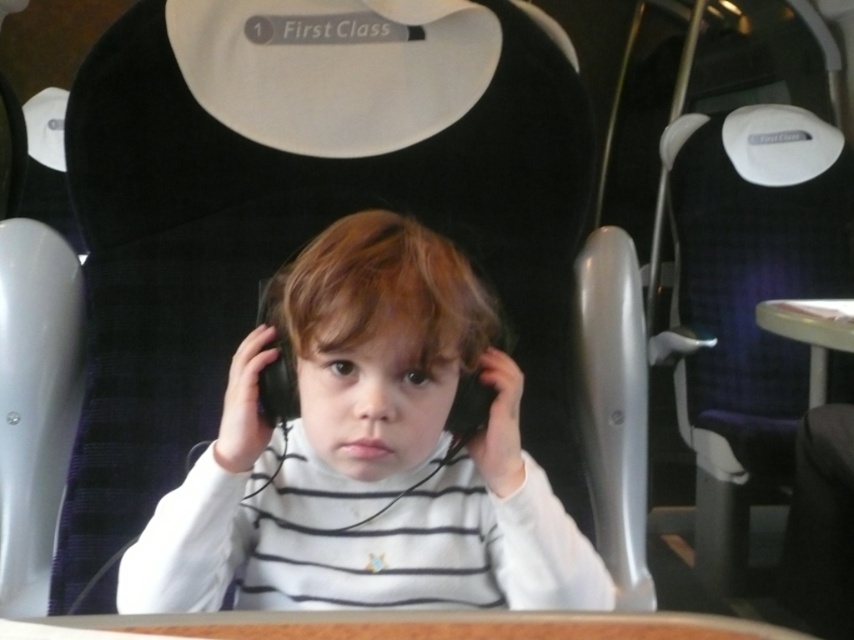
You are a passenger in the first class train compartment and need to place your belongings on the brown wood table at center or the black matte headphones at center. Which surface can you use to place your items?

The brown wood table at center is shorter than the black matte headphones at center, so the black matte headphones at center cannot be used as a surface. Please use the brown wood table at center instead.

Based on the coordinates provided, which object is located at point (749, 300)?

The purple fabric chair at center is located at point (749, 300).